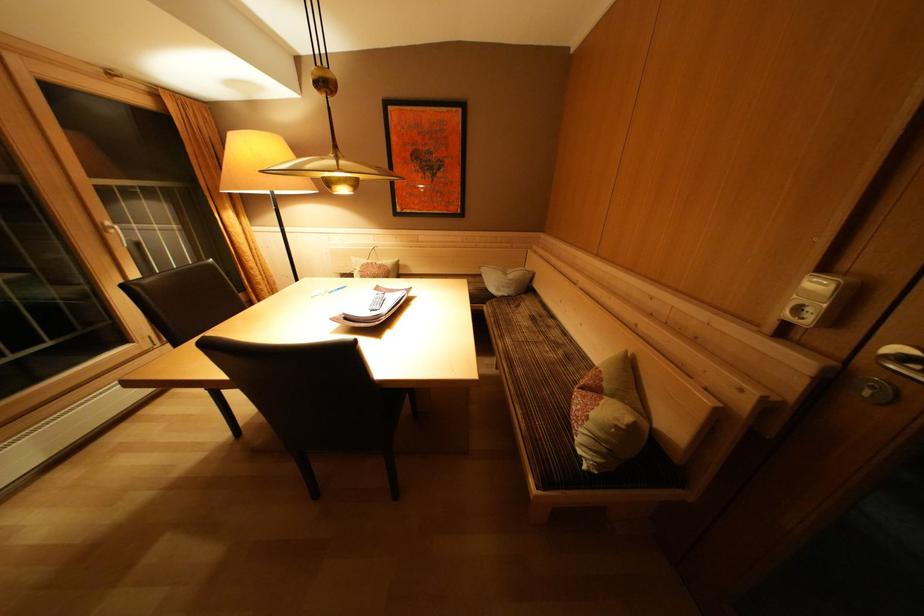
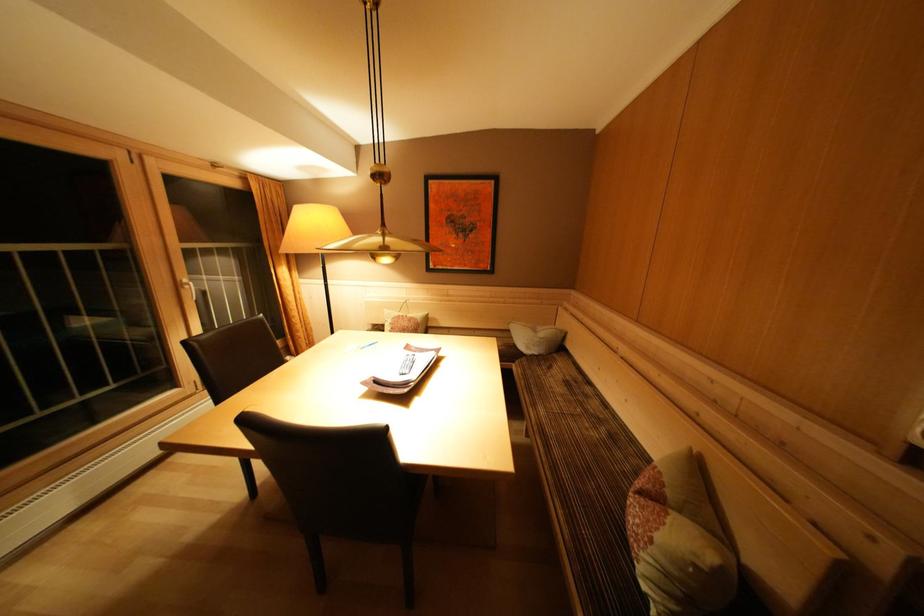
Question: What movement of the cameraman would produce the second image?

Choices:
 (A) Left
 (B) Right
 (C) Forward
 (D) Backward

Answer: (A)